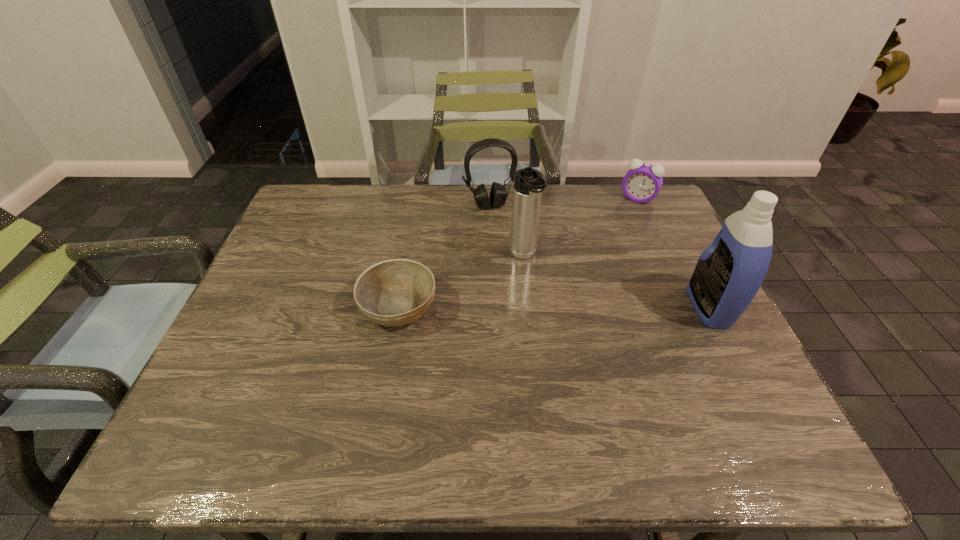
This screenshot has height=540, width=960. Identify the location of vacant point located between the headset and the shortest object. (444, 256).

Where is `vacant space that is in between the alarm clock and the fourth shortest object`? The height and width of the screenshot is (540, 960). vacant space that is in between the alarm clock and the fourth shortest object is located at coordinates (580, 227).

I want to click on unoccupied area between the alarm clock and the tallest object, so click(674, 253).

Image resolution: width=960 pixels, height=540 pixels. What are the coordinates of `free space between the alarm clock and the headset` in the screenshot? It's located at (564, 201).

Find the location of a particular element. Image resolution: width=960 pixels, height=540 pixels. free point between the alarm clock and the tallest object is located at coordinates (674, 253).

At what (x,y) coordinates should I click in order to perform the action: click on blank region between the shortest object and the second tallest object. Please return your answer as a coordinate pair (x, y). This screenshot has width=960, height=540. Looking at the image, I should click on (461, 281).

At what (x,y) coordinates should I click in order to perform the action: click on object that is the third closest one to the detergent. Please return your answer as a coordinate pair (x, y). Looking at the image, I should click on (498, 194).

At what (x,y) coordinates should I click in order to perform the action: click on object that is the nearest to the tallest object. Please return your answer as a coordinate pair (x, y). Looking at the image, I should click on (643, 181).

Image resolution: width=960 pixels, height=540 pixels. I want to click on vacant area that satisfies the following two spatial constraints: 1. on the front side of the headset; 2. on the right side of the thermos bottle, so click(492, 256).